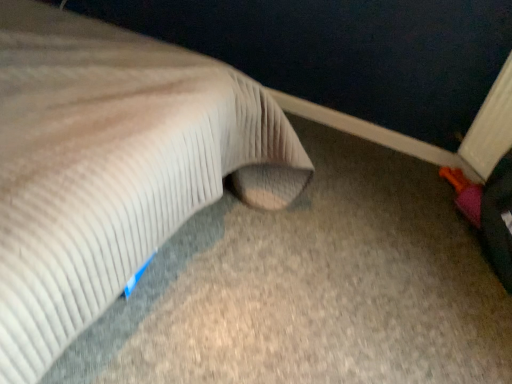
Where is `beige ribbed fabric bed at lower left`? This screenshot has width=512, height=384. beige ribbed fabric bed at lower left is located at coordinates (111, 166).

Describe the element at coordinates (111, 166) in the screenshot. Image resolution: width=512 pixels, height=384 pixels. I see `beige ribbed fabric bed at lower left` at that location.

Image resolution: width=512 pixels, height=384 pixels. What are the coordinates of `beige ribbed fabric bed at lower left` in the screenshot? It's located at (111, 166).